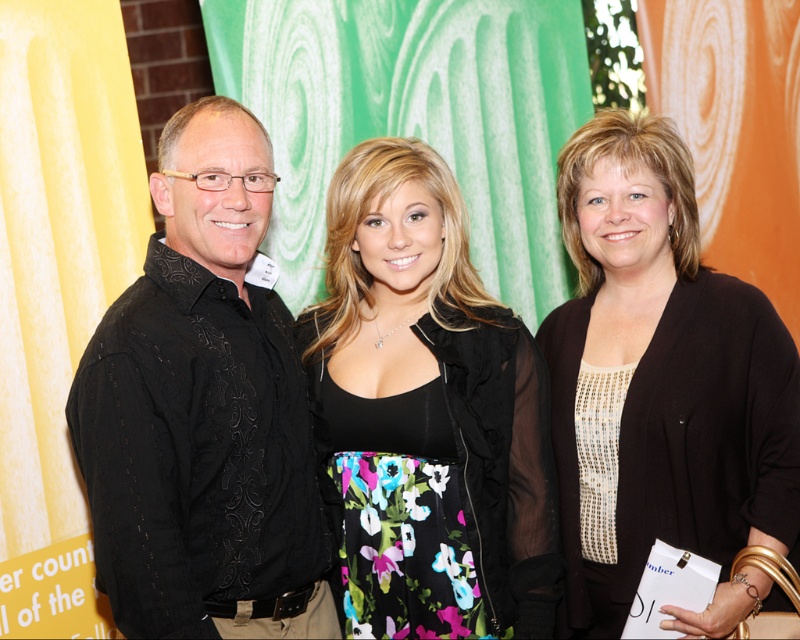
You are a photographer trying to capture a closeup of the sequined beige blouse at center and the black satin dress at center. Which one is more to the right?

The sequined beige blouse at center is positioned on the right side of black satin dress at center, so the sequined beige blouse at center is more to the right.

Please look at the three people in the image. The person on the left is wearing a black shirt with intricate embroidery. The person in the center is wearing a black sleeveless top and a floral skirt. The person on the right has a point at coordinate (x=204, y=412). Which of the three people is wearing the black embroidered shirt?

The point at coordinate (x=204, y=412) indicates the black embroidered shirt at left, so the person on the left is wearing the black embroidered shirt.